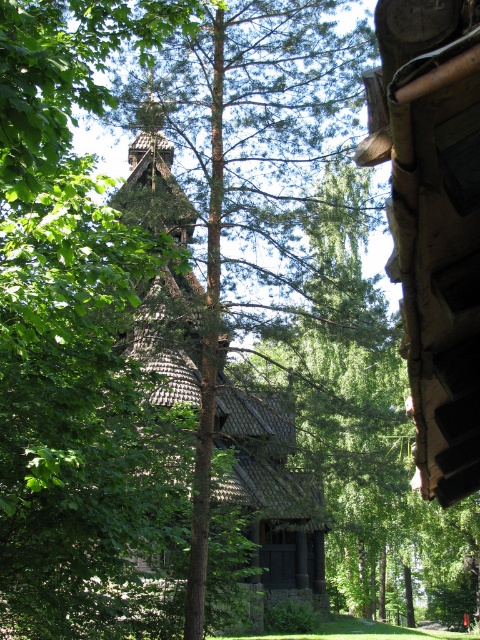
Question: Which is nearer to the wooden spire at center?

Choices:
 (A) brown wooden hut at upper right
 (B) brown wooden hut at center

Answer: (B)

Question: Based on their relative distances, which object is nearer to the brown wooden hut at center?

Choices:
 (A) wooden spire at center
 (B) brown wooden hut at upper right

Answer: (A)

Question: Is brown wooden hut at center to the left of wooden spire at center from the viewer's perspective?

Choices:
 (A) yes
 (B) no

Answer: (B)

Question: Is brown wooden hut at upper right positioned behind wooden spire at center?

Choices:
 (A) no
 (B) yes

Answer: (A)

Question: Does brown wooden hut at center appear on the right side of wooden spire at center?

Choices:
 (A) yes
 (B) no

Answer: (A)

Question: Which point is closer to the camera?

Choices:
 (A) wooden spire at center
 (B) brown wooden hut at center
 (C) brown wooden hut at upper right

Answer: (C)